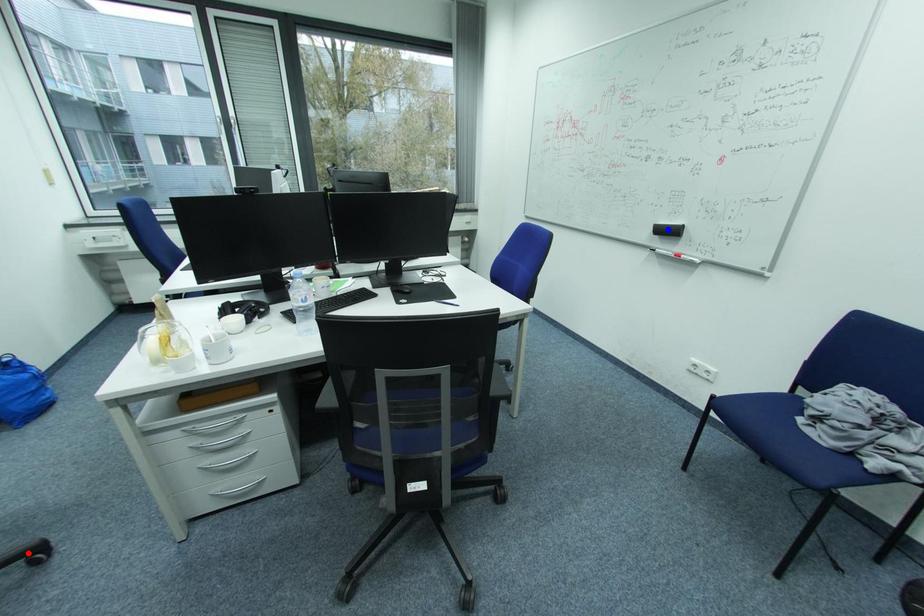
Question: In the image, two points are highlighted. Which point is nearer to the camera? Reply with the corresponding letter.

Choices:
 (A) blue point
 (B) red point

Answer: (B)